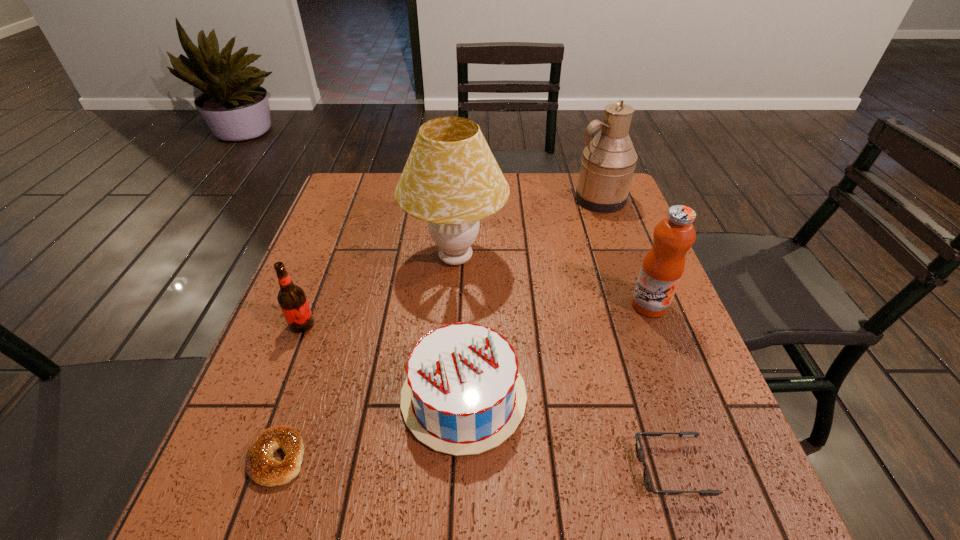
You are a GUI agent. You are given a task and a screenshot of the screen. Output one action in this format:
    pyautogui.click(x=<x>, y=<y>)
    Task: Click on the bagel at the left edge
    
    Given the screenshot: What is the action you would take?
    pyautogui.click(x=261, y=466)

This screenshot has height=540, width=960. What are the coordinates of `pitcher that is positioned at the right edge` in the screenshot? It's located at (607, 166).

You are a GUI agent. You are given a task and a screenshot of the screen. Output one action in this format:
    pyautogui.click(x=<x>, y=<y>)
    Task: Click on the fruit juice that is at the right edge
    The width and height of the screenshot is (960, 540).
    Given the screenshot: What is the action you would take?
    pyautogui.click(x=663, y=266)

Where is `sunglasses that is at the right edge`? sunglasses that is at the right edge is located at coordinates (648, 481).

This screenshot has height=540, width=960. I want to click on object that is at the near left corner, so click(x=261, y=466).

This screenshot has height=540, width=960. Find the location of `object located in the far right corner section of the desktop`. object located in the far right corner section of the desktop is located at coordinates (607, 166).

Locate an element on the screen. The height and width of the screenshot is (540, 960). object that is at the near right corner is located at coordinates 648,481.

Locate an element on the screen. The height and width of the screenshot is (540, 960). vacant space at the far edge is located at coordinates (555, 204).

The image size is (960, 540). In order to click on blank space at the near edge of the desktop in this screenshot , I will do `click(477, 521)`.

Image resolution: width=960 pixels, height=540 pixels. What are the coordinates of `vacant space at the left edge` in the screenshot? It's located at (348, 307).